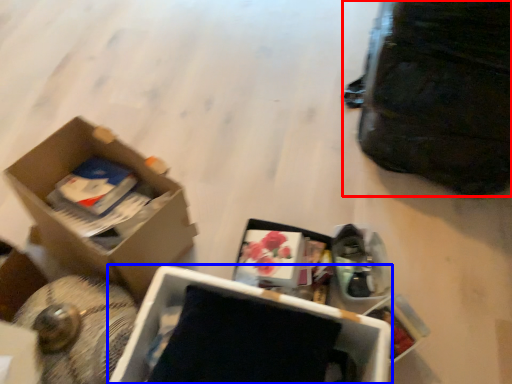
Question: Which object is further to the camera taking this photo, bag (highlighted by a red box) or box (highlighted by a blue box)?

Choices:
 (A) bag
 (B) box

Answer: (A)